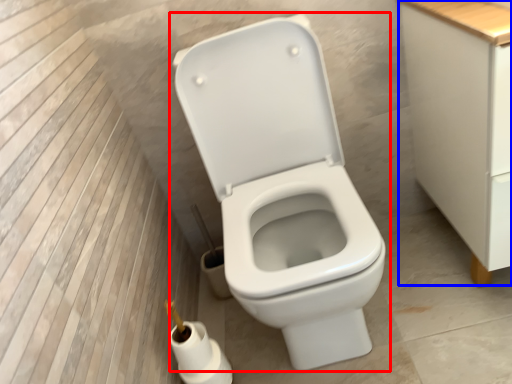
Question: Which object appears closest to the camera in this image, toilet (highlighted by a red box) or cabinetry (highlighted by a blue box)?

Choices:
 (A) toilet
 (B) cabinetry

Answer: (A)